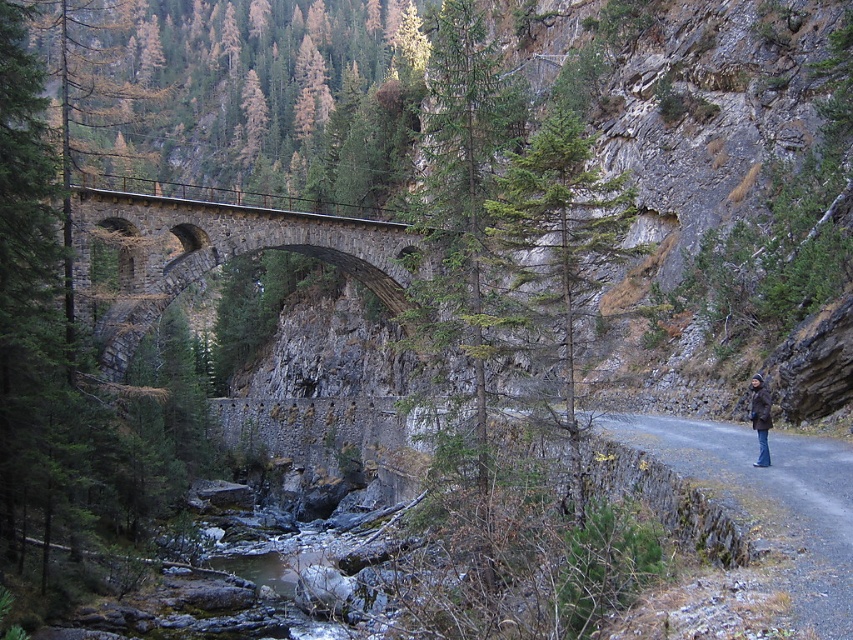
You are a hiker carrying a backpack and see the stone arch bridge at center and the dark brown leather jacket at right in the distance. Which object is bigger in size?

The stone arch bridge at center has a larger size compared to the dark brown leather jacket at right, so the stone arch bridge at center is bigger in size.

You are standing at the point labeled as point (x=215, y=252). What structure are you directly facing?

The point (x=215, y=252) indicates the stone arch bridge at center, so you are directly facing the stone arch bridge at center.

You are a hiker who has just arrived at the stone arch bridge at center and wants to place your dark brown leather jacket at right on a nearby rock. Which direction should you walk to reach the jacket?

The stone arch bridge at center is positioned on the left side of dark brown leather jacket at right, so you should walk to your right to reach the jacket.